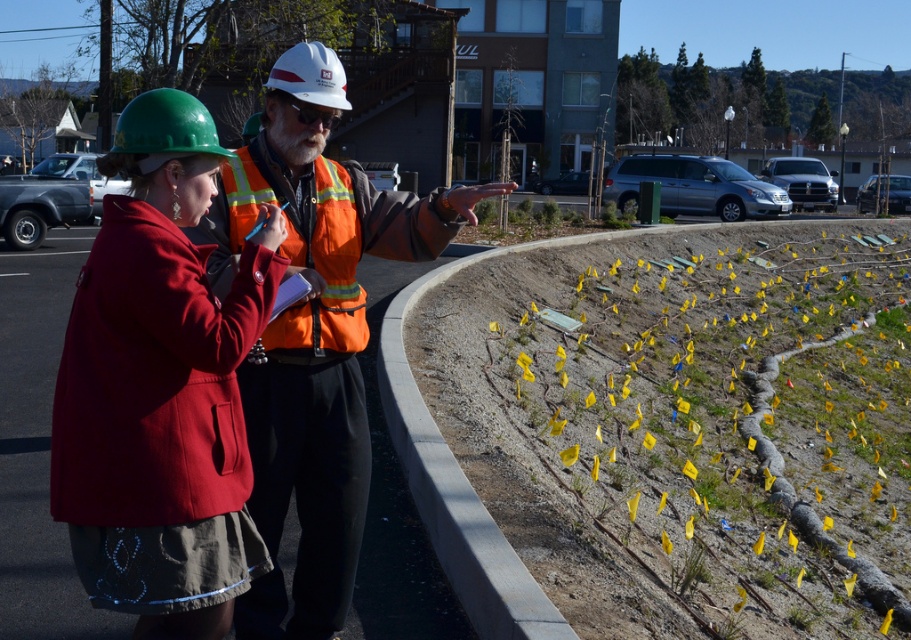
Question: Is reflective orange safety vest at center smaller than orange reflective safety vest at center?

Choices:
 (A) no
 (B) yes

Answer: (A)

Question: Is concrete at lower right to the left of orange reflective safety vest at center from the viewer's perspective?

Choices:
 (A) no
 (B) yes

Answer: (A)

Question: Which object appears closest to the camera in this image?

Choices:
 (A) yellow paper at upper right
 (B) reflective orange safety vest at center

Answer: (B)

Question: Which of the following is the closest to the observer?

Choices:
 (A) (695, 458)
 (B) (335, 326)
 (C) (489, 257)

Answer: (B)

Question: Does yellow paper at upper right have a lesser width compared to orange reflective safety vest at center?

Choices:
 (A) yes
 (B) no

Answer: (B)

Question: Which point is farther from the camera taking this photo?

Choices:
 (A) (313, 340)
 (B) (713, 381)
 (C) (152, 216)
 (D) (265, 362)

Answer: (B)